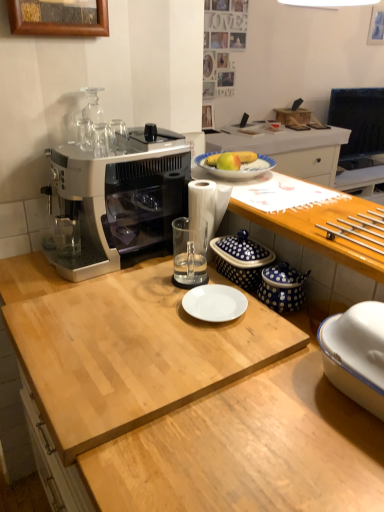
Identify the location of unoccupied region to the right of yellow matte apple at center. (278, 180).